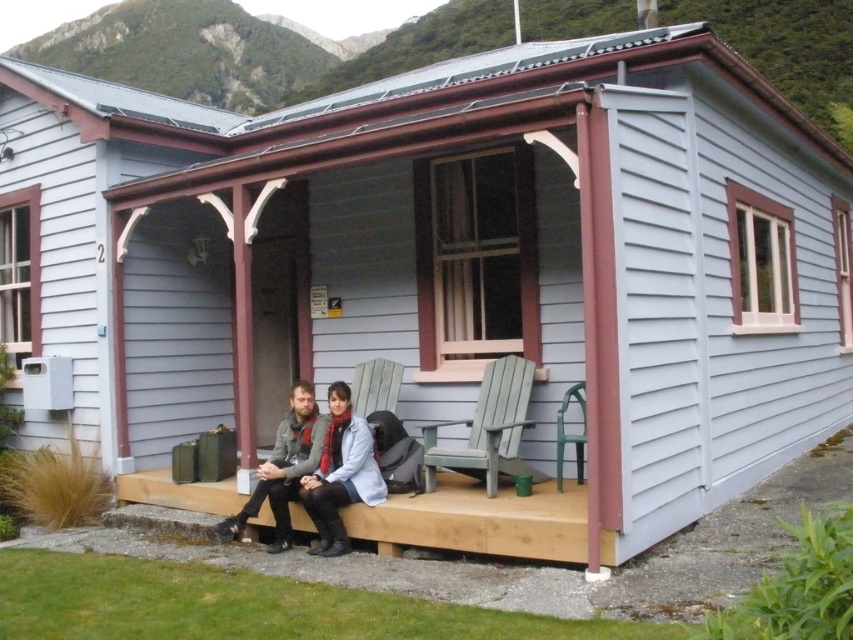
Question: Which of the following is the closest to the observer?

Choices:
 (A) matte gray jacket at center
 (B) wooden bench at center

Answer: (B)

Question: Does wooden bench at center have a smaller size compared to matte gray jacket at center?

Choices:
 (A) no
 (B) yes

Answer: (B)

Question: Observing the image, what is the correct spatial positioning of wooden bench at center in reference to matte gray jacket at center?

Choices:
 (A) above
 (B) below

Answer: (B)

Question: Where is wooden bench at center located in relation to matte gray jacket at center in the image?

Choices:
 (A) below
 (B) above

Answer: (A)

Question: Which of the following is the closest to the observer?

Choices:
 (A) wooden bench at center
 (B) matte gray jacket at center

Answer: (A)